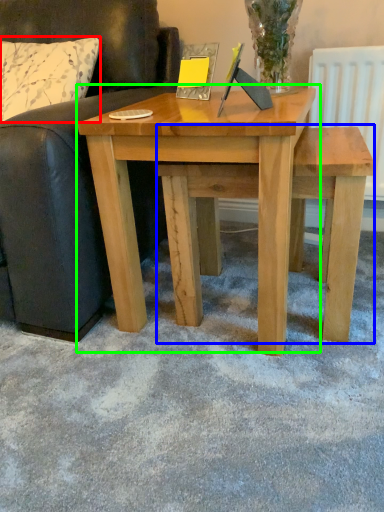
Question: Which object is the closest to the pillow (highlighted by a red box)? Choose among these: stool (highlighted by a blue box) or table (highlighted by a green box).

Choices:
 (A) stool
 (B) table

Answer: (B)